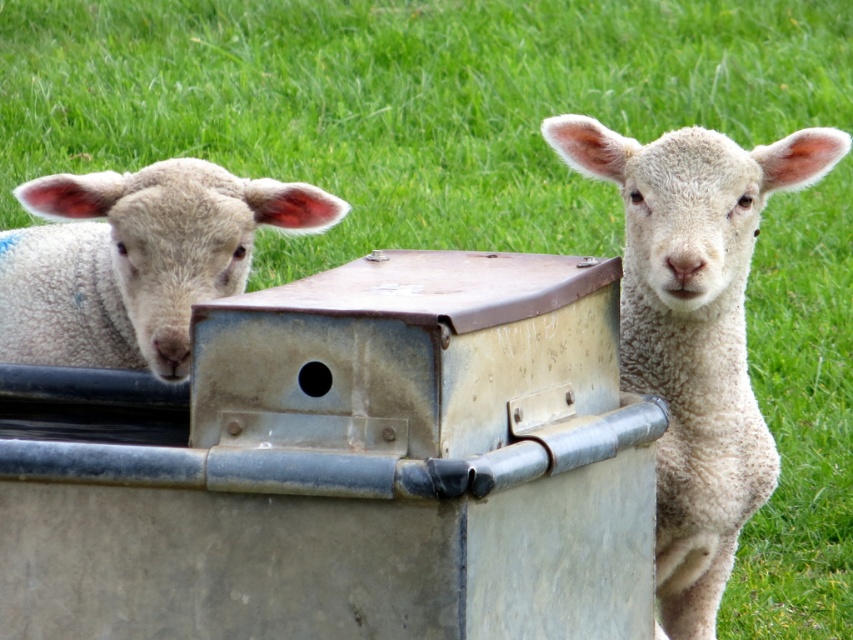
Looking at this image, does white woolen lamb at center lie behind white woolen lamb at left?

Yes, it is.

Is point (694, 228) closer to camera compared to point (12, 280)?

That is True.

You are a GUI agent. You are given a task and a screenshot of the screen. Output one action in this format:
    pyautogui.click(x=<x>, y=<y>)
    Task: Click on the white woolen lamb at center
    This screenshot has height=640, width=853.
    Given the screenshot: What is the action you would take?
    pyautogui.click(x=694, y=330)